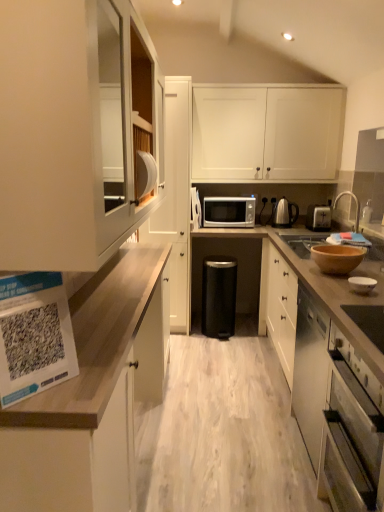
You are a GUI agent. You are given a task and a screenshot of the screen. Output one action in this format:
    pyautogui.click(x=<x>, y=<y>)
    Task: Click on the vacant space underneath white matte cabinet at upper left, the first cabinetry when ordered from left to right (from a real-world perspective)
    Image resolution: width=384 pixels, height=512 pixels.
    Given the screenshot: What is the action you would take?
    pyautogui.click(x=117, y=285)